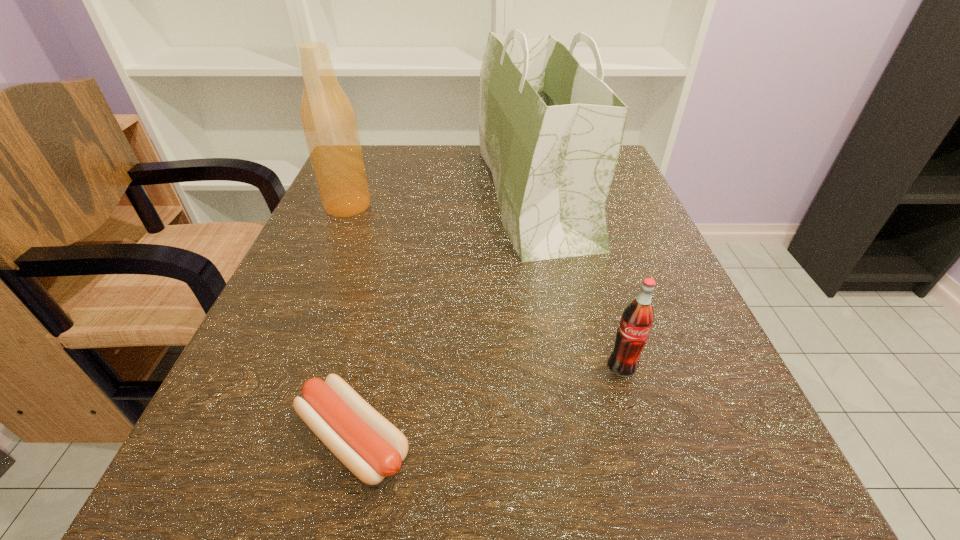
I want to click on vacant space at the far edge, so click(x=409, y=179).

Image resolution: width=960 pixels, height=540 pixels. In the image, there is a desktop. What are the coordinates of `vacant space at the left edge` in the screenshot? It's located at (396, 214).

In the image, there is a desktop. At what (x,y) coordinates should I click in order to perform the action: click on vacant space at the right edge. Please return your answer as a coordinate pair (x, y). The width and height of the screenshot is (960, 540). Looking at the image, I should click on (689, 345).

In the image, there is a desktop. Identify the location of vacant space at the far left corner. (386, 184).

Where is `vacant space at the near right corner of the desktop`? This screenshot has height=540, width=960. vacant space at the near right corner of the desktop is located at coordinates (683, 490).

Find the location of a particular element. This screenshot has width=960, height=540. vacant space in between the leftmost object and the second object from left to right is located at coordinates (350, 322).

Locate an element on the screen. The width and height of the screenshot is (960, 540). free spot between the beer bottle and the nearest object is located at coordinates (350, 322).

Where is `vacant area that lies between the beer bottle and the nearest object`? vacant area that lies between the beer bottle and the nearest object is located at coordinates (350, 322).

The width and height of the screenshot is (960, 540). What are the coordinates of `empty space that is in between the soda bottle and the grocery bag` in the screenshot? It's located at (578, 281).

Find the location of `free space between the beer bottle and the second shortest object`. free space between the beer bottle and the second shortest object is located at coordinates (485, 286).